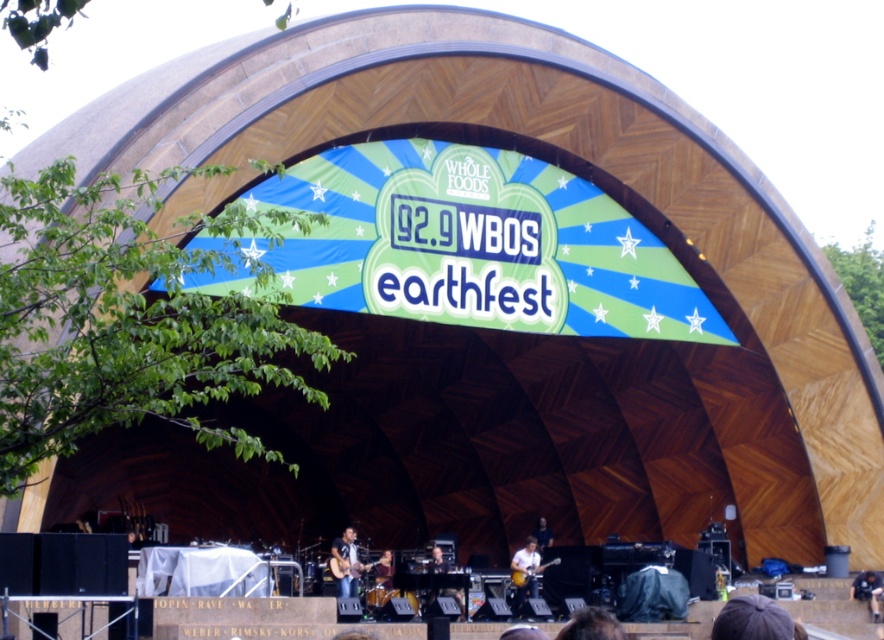
Measure the distance from brown fabric cap at lower center to matte brown guitar at center.

22.37 meters

Between brown fabric cap at lower center and matte brown guitar at center, which one is positioned lower?

Positioned lower is matte brown guitar at center.

Does point (758, 612) come farther from viewer compared to point (349, 552)?

No, (758, 612) is closer to viewer.

I want to click on brown fabric cap at lower center, so click(752, 620).

Does brown hair at lower center lie behind dark brown leather jacket at lower center?

No, brown hair at lower center is in front of dark brown leather jacket at lower center.

At what (x,y) coordinates should I click in order to perform the action: click on brown hair at lower center. Please return your answer as a coordinate pair (x, y). This screenshot has height=640, width=884. Looking at the image, I should click on (x=591, y=625).

Who is more distant from viewer, (775,609) or (875,588)?

The point (875,588) is behind.

From the picture: Who is lower down, brown fabric cap at lower center or dark blue jeans at lower right?

dark blue jeans at lower right is lower down.

Between point (732, 605) and point (874, 616), which one is positioned in front?

Point (732, 605)

Where is `brown fabric cap at lower center`? Image resolution: width=884 pixels, height=640 pixels. brown fabric cap at lower center is located at coordinates 752,620.